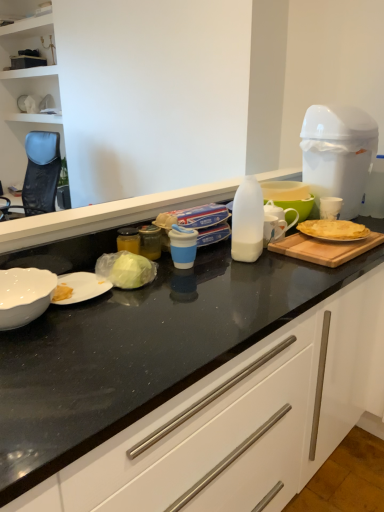
Where is `white glossy countertop at center`? The width and height of the screenshot is (384, 512). white glossy countertop at center is located at coordinates (241, 420).

You are a GUI agent. You are given a task and a screenshot of the screen. Output one action in this format:
    pyautogui.click(x=<x>, y=<y>)
    Task: Click on the wooden cutting board at right
    The width and height of the screenshot is (384, 512).
    Given the screenshot: What is the action you would take?
    pyautogui.click(x=324, y=248)

What do you see at coordinates (324, 248) in the screenshot? Image resolution: width=384 pixels, height=512 pixels. I see `wooden cutting board at right` at bounding box center [324, 248].

At what (x,y) coordinates should I click in order to perform the action: click on translucent plastic milk bottle at center. Please return your answer as a coordinate pair (x, y). Looking at the image, I should click on (106, 215).

The image size is (384, 512). What do you see at coordinates (106, 215) in the screenshot?
I see `translucent plastic milk bottle at center` at bounding box center [106, 215].

Locate an element on the screen. white glossy countertop at center is located at coordinates (241, 420).

Considering the relative sizes of white glossy bowl at lower left and white glossy countertop at center in the image provided, is white glossy bowl at lower left bigger than white glossy countertop at center?

Actually, white glossy bowl at lower left might be smaller than white glossy countertop at center.

Identify the location of cabinetry directly beneath the white glossy bowl at lower left (from a real-world perspective). (241, 420).

Based on the photo, from the image's perspective, is white glossy bowl at lower left located beneath white glossy countertop at center?

No, from the image's perspective, white glossy bowl at lower left is not below white glossy countertop at center.

From the image's perspective, is white plastic trash can at upper right above or below white glossy countertop at center?

Clearly, from the image's perspective, white plastic trash can at upper right is above white glossy countertop at center.

Is point (319, 135) farther from camera compared to point (186, 449)?

That is True.

Is golden crispy crepe at right wider or thinner than white glossy countertop at center?

Considering their sizes, golden crispy crepe at right looks slimmer than white glossy countertop at center.

Consider the image. Is golden crispy crepe at right positioned beyond the bounds of white glossy countertop at center?

No, golden crispy crepe at right is not entirely external to white glossy countertop at center.

Which object is positioned more to the left, golden crispy crepe at right or white glossy countertop at center?

white glossy countertop at center.

Considering the positions of points (312, 221) and (243, 509), is point (312, 221) farther from camera compared to point (243, 509)?

Yes, point (312, 221) is farther from viewer.

Between wooden cutting board at right and white plastic trash can at upper right, which one has larger size?

white plastic trash can at upper right is bigger.

Is white plastic trash can at upper right located within wooden cutting board at right?

No, white plastic trash can at upper right is located outside of wooden cutting board at right.

From the image's perspective, is wooden cutting board at right under white plastic trash can at upper right?

Correct, wooden cutting board at right appears lower than white plastic trash can at upper right in the image.

Where is `cutting board located below the white plastic trash can at upper right (from the image's perspective)`? cutting board located below the white plastic trash can at upper right (from the image's perspective) is located at coordinates (324, 248).

Is translucent plastic milk bottle at center situated inside golden crispy crepe at right or outside?

translucent plastic milk bottle at center exists outside the volume of golden crispy crepe at right.

From a real-world perspective, which is physically below, translucent plastic milk bottle at center or golden crispy crepe at right?

golden crispy crepe at right.

From the image's perspective, does translucent plastic milk bottle at center appear higher than golden crispy crepe at right?

Yes, from the image's perspective, translucent plastic milk bottle at center is above golden crispy crepe at right.

Which object is thinner, wooden cutting board at right or golden crispy crepe at right?

golden crispy crepe at right is thinner.

Considering the positions of objects wooden cutting board at right and golden crispy crepe at right in the image provided, who is more to the right, wooden cutting board at right or golden crispy crepe at right?

golden crispy crepe at right is more to the right.

Which is farther, (x=275, y=244) or (x=339, y=233)?

The point (x=339, y=233) is behind.

Is white glossy bowl at lower left far from wooden cutting board at right?

No, there isn't a large distance between white glossy bowl at lower left and wooden cutting board at right.

How different are the orientations of white glossy bowl at lower left and wooden cutting board at right in degrees?

white glossy bowl at lower left and wooden cutting board at right are facing 0.00215 degrees away from each other.

Identify the location of kitchen appliance positioned vertically above the wooden cutting board at right (from a real-world perspective). The image size is (384, 512). (24, 295).

Which is farther from the camera, (1, 298) or (296, 246)?

The point (296, 246) is farther.

At what (x,y) coordinates should I click in order to perform the action: click on kitchen appliance that is above the white glossy countertop at center (from the image's perspective). Please return your answer as a coordinate pair (x, y). The width and height of the screenshot is (384, 512). Looking at the image, I should click on (24, 295).

Where is `cabinetry that appears below the white plastic trash can at upper right (from the image's perspective)`? cabinetry that appears below the white plastic trash can at upper right (from the image's perspective) is located at coordinates (241, 420).

Which object lies nearer to the anchor point white plastic trash can at upper right, golden crispy crepe at right or white glossy bowl at lower left?

golden crispy crepe at right lies closer to white plastic trash can at upper right than the other object.

Which object lies nearer to the anchor point white glossy bowl at lower left, wooden cutting board at right or white plastic trash can at upper right?

wooden cutting board at right is closer to white glossy bowl at lower left.

Looking at the image, which one is located further to wooden cutting board at right, golden crispy crepe at right or translucent plastic milk bottle at center?

The object further to wooden cutting board at right is translucent plastic milk bottle at center.

Estimate the real-world distances between objects in this image. Which object is closer to golden crispy crepe at right, wooden cutting board at right or white glossy bowl at lower left?

wooden cutting board at right is positioned closer to the anchor golden crispy crepe at right.

In the scene shown: Which object lies further to the anchor point white glossy countertop at center, white plastic trash can at upper right or wooden cutting board at right?

white plastic trash can at upper right.

When comparing their distances from golden crispy crepe at right, does white glossy bowl at lower left or translucent plastic milk bottle at center seem closer?

Among the two, translucent plastic milk bottle at center is located nearer to golden crispy crepe at right.

When comparing their distances from white glossy countertop at center, does translucent plastic milk bottle at center or wooden cutting board at right seem further?

translucent plastic milk bottle at center lies further to white glossy countertop at center than the other object.

Based on the photo, considering their positions, is wooden cutting board at right positioned closer to golden crispy crepe at right than white glossy countertop at center?

wooden cutting board at right lies closer to golden crispy crepe at right than the other object.

The height and width of the screenshot is (512, 384). I want to click on food between translucent plastic milk bottle at center and white plastic trash can at upper right from left to right, so click(334, 229).

Locate an element on the screen. This screenshot has width=384, height=512. cutting board between translucent plastic milk bottle at center and white plastic trash can at upper right is located at coordinates (324, 248).

This screenshot has height=512, width=384. Identify the location of countertop between white glossy bowl at lower left and white plastic trash can at upper right in the horizontal direction. (106, 215).

The height and width of the screenshot is (512, 384). I want to click on countertop located between white glossy countertop at center and white plastic trash can at upper right in the depth direction, so click(x=106, y=215).